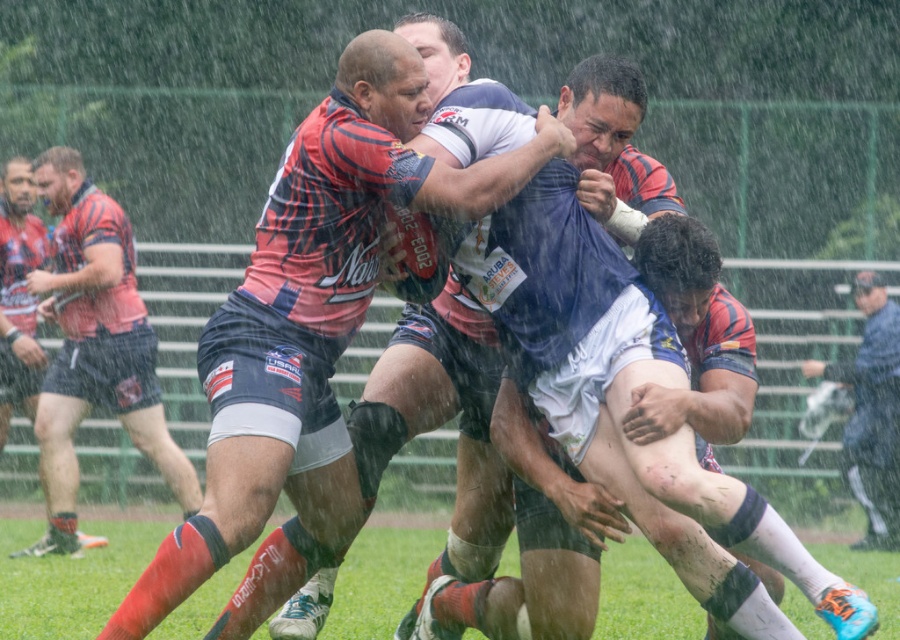
Based on the coordinates provided, which object is positioned at point (94, 346)?

The matte red shirt at left is positioned at point (94, 346).

You are a spectator at the rugby match and want to take a photo of both the matte red and blue rugby jersey at center and the matte red shirt at left. Which jersey should you focus on first to capture both in the frame?

You should focus on the matte red shirt at left first because the matte red and blue rugby jersey at center is to its right, so adjusting the camera to include both would require starting from the leftmost object.

You are a photographer trying to capture the action during the rugby match. You notice two points in the image at coordinates point (x=327, y=474) and point (x=45, y=467). Which point is closer to your camera lens?

Point (x=327, y=474) is closer to the camera lens than point (x=45, y=467).